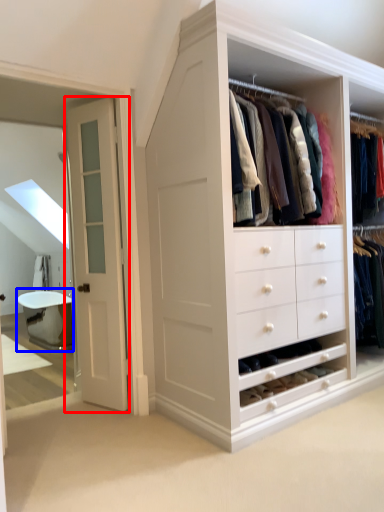
Question: Which of the following is the closest to the observer, door (highlighted by a red box) or bath (highlighted by a blue box)?

Choices:
 (A) door
 (B) bath

Answer: (A)